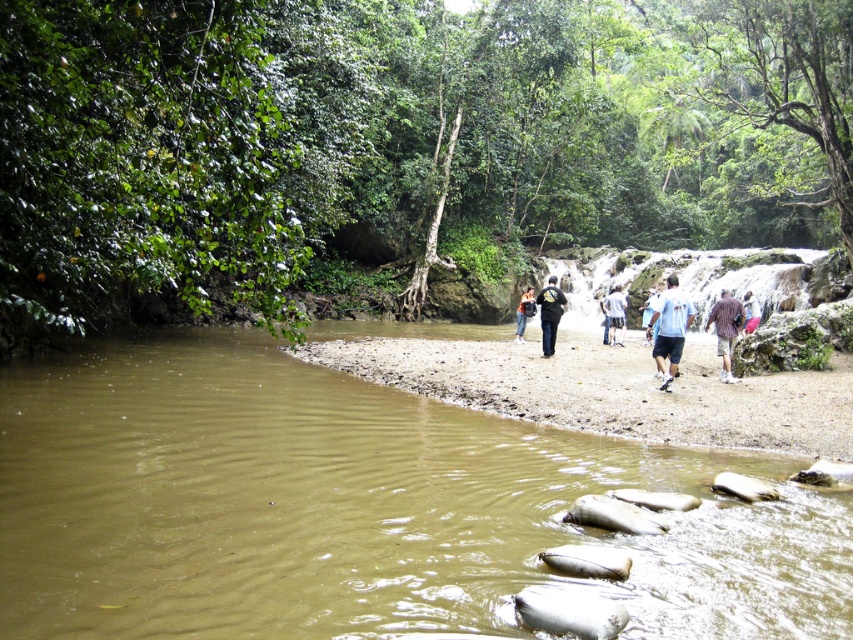
You are a photographer standing on the riverbank and want to capture both the dark blue jeans at center and the white cotton shirt at center in a single photo. Which object should you focus on first to ensure both are in frame?

The dark blue jeans at center is taller than the white cotton shirt at center, so you should focus on the dark blue jeans at center first to ensure both are in frame.

Looking at this image, you are standing at the point with coordinates point (608, 323) and want to walk to the point with coordinates point (727, 323). Which direction should you face to walk straight towards your destination?

You should face forward because point (727, 323) is in front of point (608, 323).